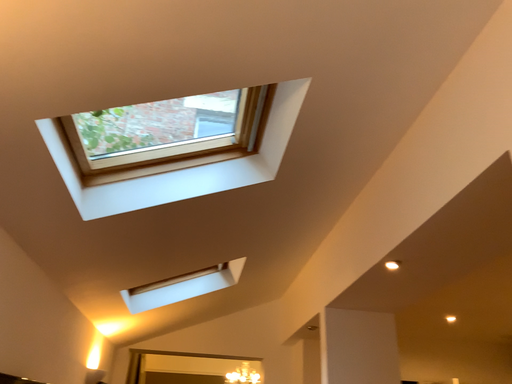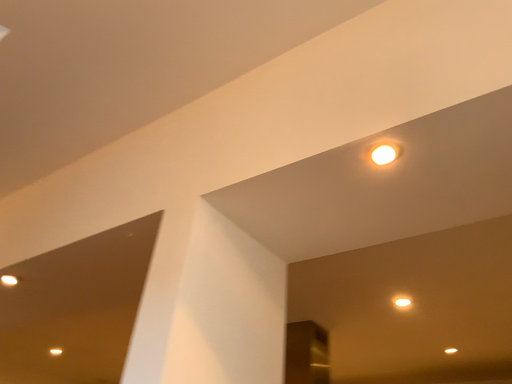
Question: Which way did the camera rotate in the video?

Choices:
 (A) rotated right
 (B) rotated left

Answer: (A)